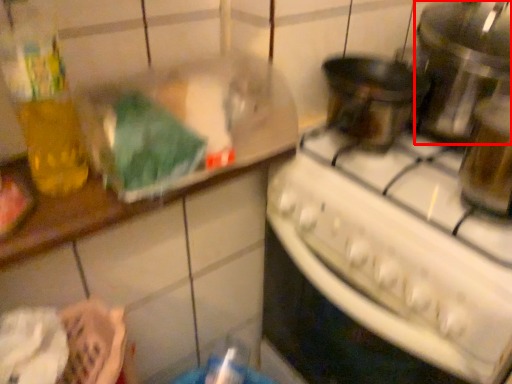
Question: In this image, where is appliance (annotated by the red box) located relative to kitchen appliance?

Choices:
 (A) left
 (B) right

Answer: (B)